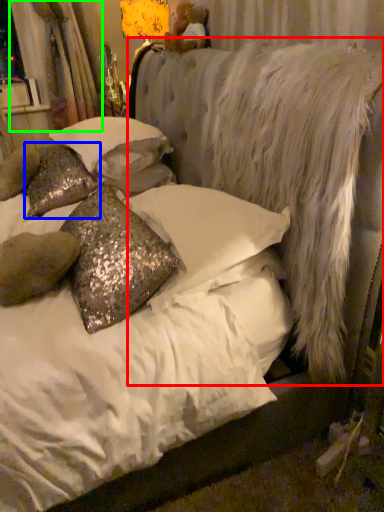
Question: Based on their relative distances, which object is nearer to mattress (highlighted by a red box)? Choose from pillow (highlighted by a blue box) and curtain (highlighted by a green box).

Choices:
 (A) pillow
 (B) curtain

Answer: (A)